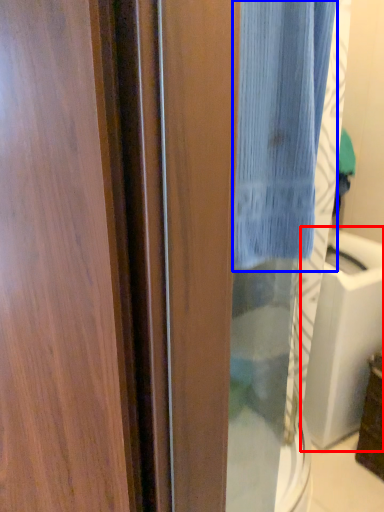
Question: Which point is closer to the camera, sink (highlighted by a red box) or curtain (highlighted by a blue box)?

Choices:
 (A) sink
 (B) curtain

Answer: (B)